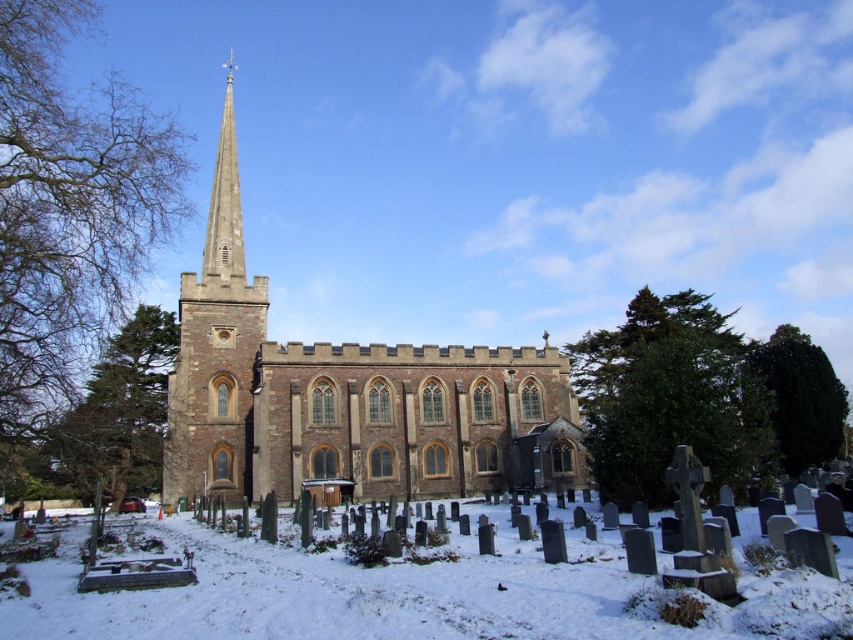
Is brown stone church at center positioned in front of white powdery snow at lower center?

That is False.

Is brown stone church at center taller than white powdery snow at lower center?

Correct, brown stone church at center is much taller as white powdery snow at lower center.

Which is behind, point (241, 250) or point (807, 630)?

The point (241, 250) is behind.

At what (x,y) coordinates should I click in order to perform the action: click on brown stone church at center. Please return your answer as a coordinate pair (x, y). The height and width of the screenshot is (640, 853). Looking at the image, I should click on (347, 396).